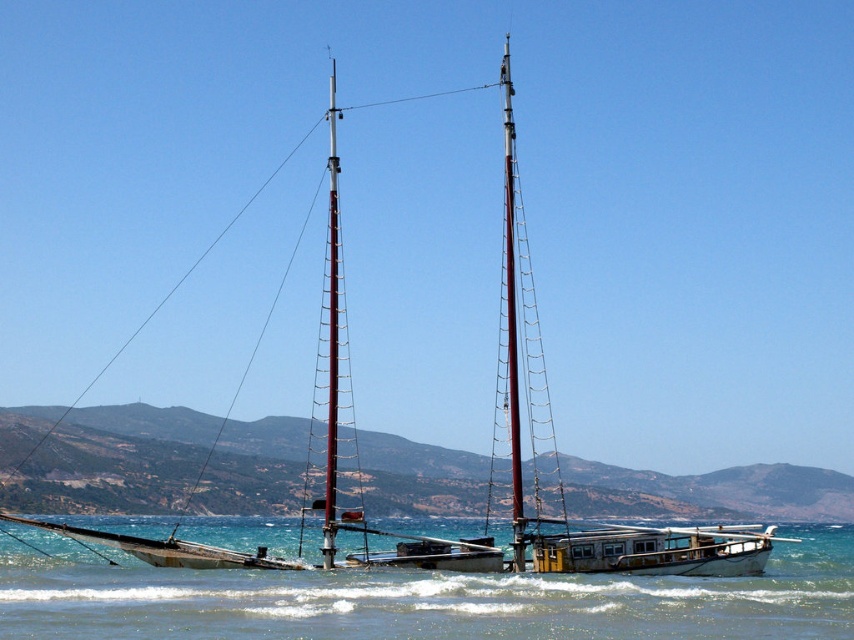
From the picture: You are standing on the shore looking at the scene. Which object is closer to you, the clear blue water at center or the metallic red mast at center?

The clear blue water at center is closer to you because it is in front of the metallic red mast at center.

You are standing on the shore looking at the two masts of the ship. Which mast, the smooth wood mast at center or the metallic red mast at center, is closer to you?

The smooth wood mast at center is closer to you because it is in front of the metallic red mast at center.